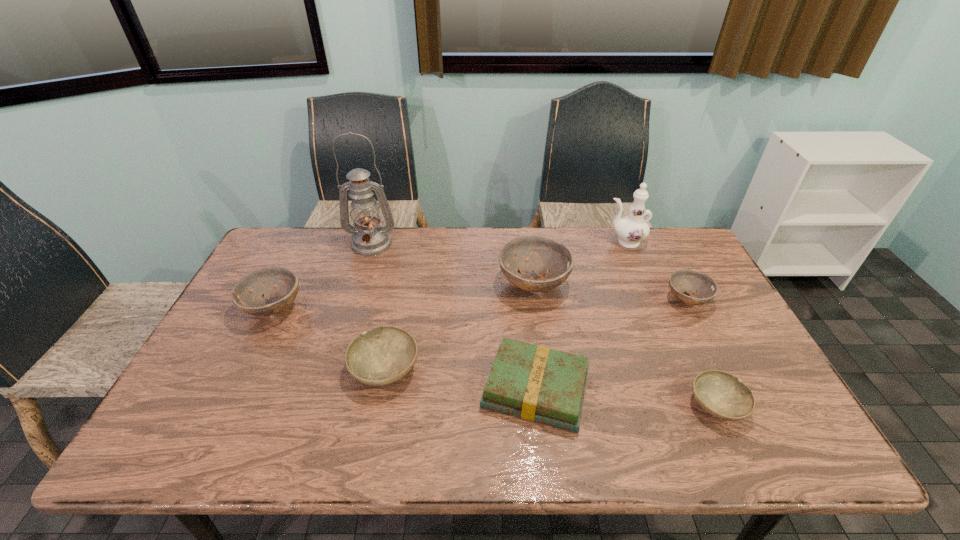
Identify the location of gray oil lamp. This screenshot has width=960, height=540. [x=368, y=239].

Image resolution: width=960 pixels, height=540 pixels. I want to click on the tallest object, so click(x=368, y=239).

Identify the location of the second tallest object. (632, 229).

Identify the location of the biggest brown bowl. The height and width of the screenshot is (540, 960). (552, 261).

At what (x,y) coordinates should I click in order to perform the action: click on the second brown bowl from right to left. Please return your answer as a coordinate pair (x, y). The height and width of the screenshot is (540, 960). Looking at the image, I should click on (552, 261).

This screenshot has width=960, height=540. I want to click on the leftmost brown bowl, so click(246, 294).

The width and height of the screenshot is (960, 540). Find the location of `the leftmost bowl`. the leftmost bowl is located at coordinates (246, 294).

In order to click on the fourth bowl from right to left in this screenshot , I will do `click(383, 355)`.

Image resolution: width=960 pixels, height=540 pixels. Find the location of `the left gray bowl`. the left gray bowl is located at coordinates (383, 355).

Where is `the smallest brown bowl`? the smallest brown bowl is located at coordinates (701, 288).